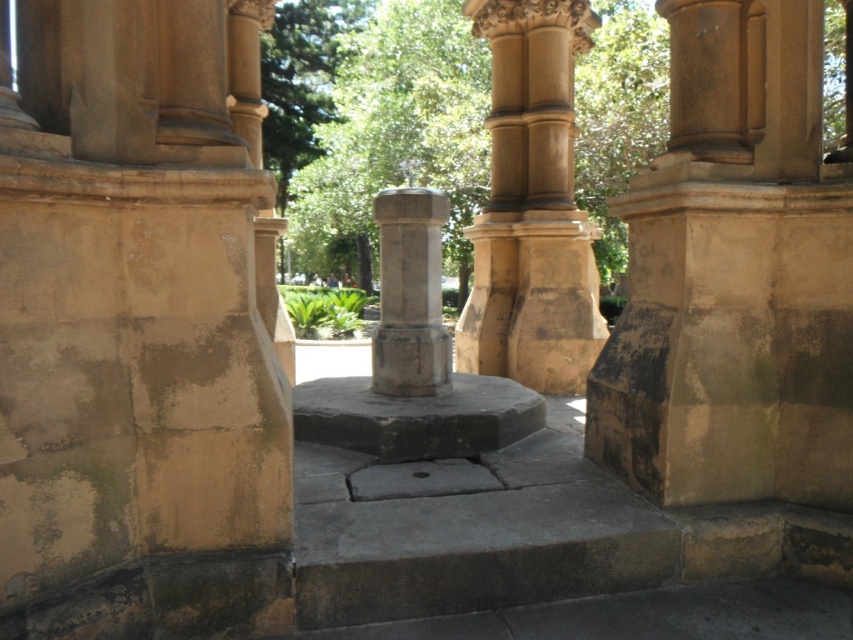
You are an architect examining the structure. You notice the dark gray stone pedestal at center and the stone column at center. Which object is located below the other?

The dark gray stone pedestal at center is positioned under the stone column at center.